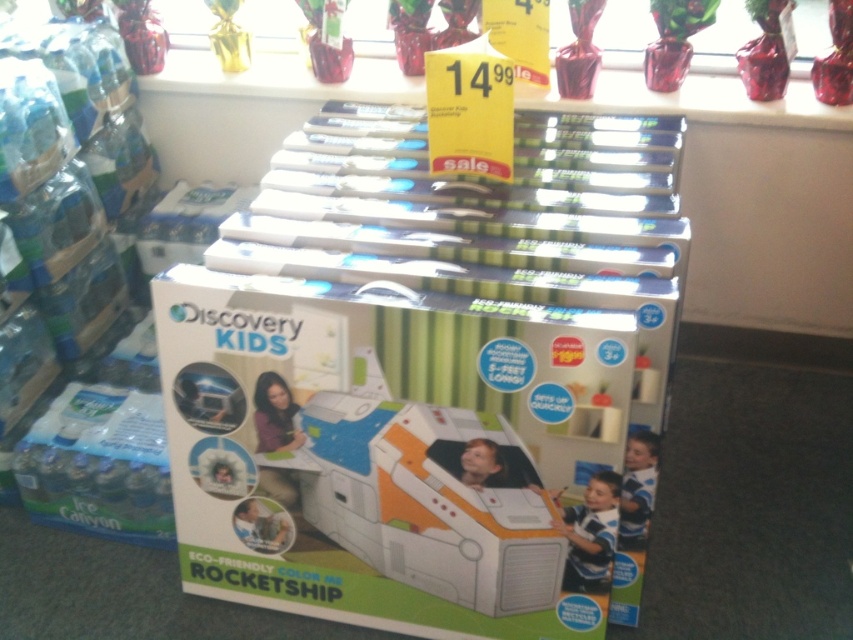
Question: Is glassy clear vase at upper center above transparent glass vase at upper center?

Choices:
 (A) yes
 (B) no

Answer: (A)

Question: Can you confirm if white cardboard box at center is smaller than glassy clear vase at upper center?

Choices:
 (A) yes
 (B) no

Answer: (B)

Question: Which of these objects is positioned closest to the blue striped shirt at lower right?

Choices:
 (A) white cardboard box at center
 (B) shiny red glass vase at upper center
 (C) glassy clear vase at upper center
 (D) shiny red glass vase at upper right

Answer: (A)

Question: Based on their relative distances, which object is nearer to the blue striped shirt at lower right?

Choices:
 (A) transparent glass vase at upper center
 (B) glassy clear vase at upper center
 (C) white cardboard box at center
 (D) shiny red glass vase at upper center

Answer: (C)

Question: Is glassy clear vase at upper center further to the viewer compared to shiny red glass vase at upper center?

Choices:
 (A) no
 (B) yes

Answer: (B)

Question: Considering the real-world distances, which object is closest to the blue striped shirt at lower right?

Choices:
 (A) transparent glass vase at upper center
 (B) glassy clear vase at upper center
 (C) shiny red glass vase at upper center

Answer: (C)